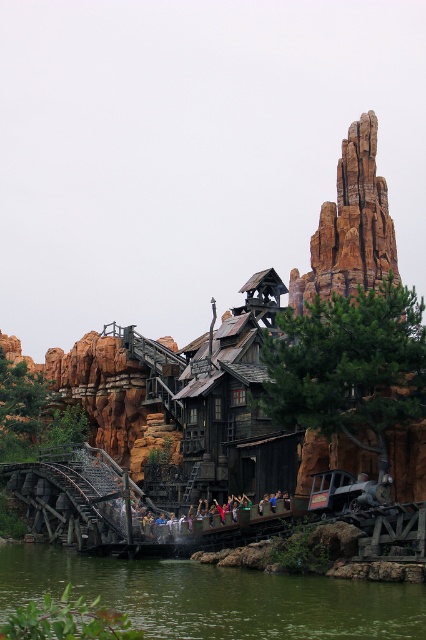
Question: Among these objects, which one is farthest from the camera?

Choices:
 (A) green water at lower center
 (B) wooden roller coaster at center
 (C) rustic stone rock formation at upper right

Answer: (C)

Question: Can you confirm if wooden roller coaster at center is bigger than multicolored fabric boat at center?

Choices:
 (A) yes
 (B) no

Answer: (A)

Question: Based on their relative distances, which object is farther from the green water at lower center?

Choices:
 (A) multicolored fabric boat at center
 (B) wooden roller coaster at center
 (C) rustic stone rock formation at upper right

Answer: (C)

Question: Estimate the real-world distances between objects in this image. Which object is farther from the rustic stone rock formation at upper right?

Choices:
 (A) wooden roller coaster at center
 (B) multicolored fabric boat at center

Answer: (B)

Question: Is wooden roller coaster at center thinner than multicolored fabric boat at center?

Choices:
 (A) no
 (B) yes

Answer: (A)

Question: Does wooden roller coaster at center lie in front of rustic stone rock formation at upper right?

Choices:
 (A) no
 (B) yes

Answer: (B)